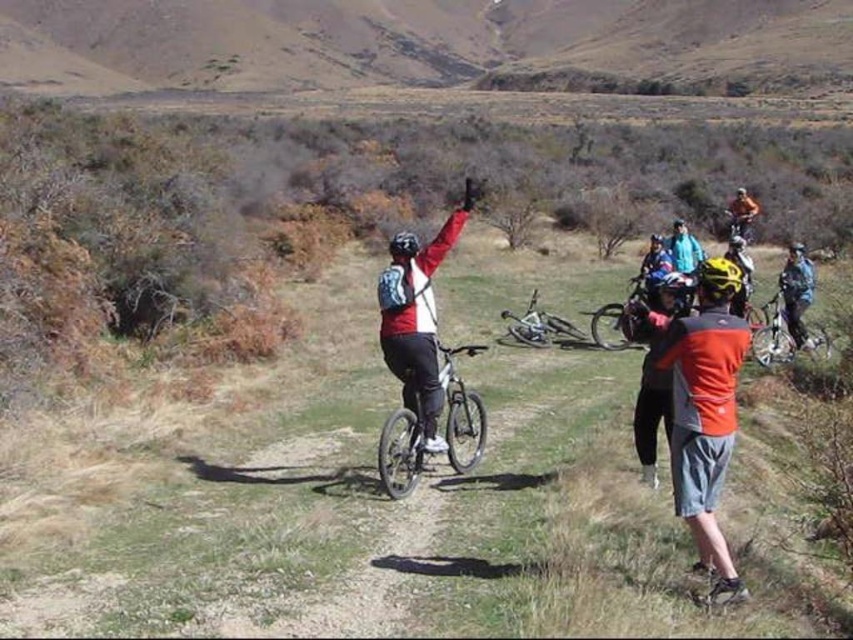
Is point (402, 419) positioned in front of point (793, 332)?

Yes, it is in front of point (793, 332).

Consider the image. Is silver metallic mountain bike at center wider than silver metallic bicycle at center right?

In fact, silver metallic mountain bike at center might be narrower than silver metallic bicycle at center right.

The image size is (853, 640). I want to click on silver metallic mountain bike at center, so click(x=402, y=444).

Between orange fabric shirt at center and shiny blue helmet at center, which one has more height?

With more height is orange fabric shirt at center.

Does orange fabric shirt at center have a greater width compared to shiny blue helmet at center?

Yes, orange fabric shirt at center is wider than shiny blue helmet at center.

The width and height of the screenshot is (853, 640). Describe the element at coordinates (705, 413) in the screenshot. I see `orange fabric shirt at center` at that location.

The width and height of the screenshot is (853, 640). Find the location of `orange fabric shirt at center`. orange fabric shirt at center is located at coordinates pos(705,413).

This screenshot has width=853, height=640. What do you see at coordinates (616, 317) in the screenshot?
I see `shiny metallic bicycle at center` at bounding box center [616, 317].

Is shiny metallic bicycle at center taller than matte black helmet at center?

In fact, shiny metallic bicycle at center may be shorter than matte black helmet at center.

Who is more forward, (612,320) or (410,232)?

Positioned in front is point (612,320).

Find the location of `shiny metallic bicycle at center`. shiny metallic bicycle at center is located at coordinates (616, 317).